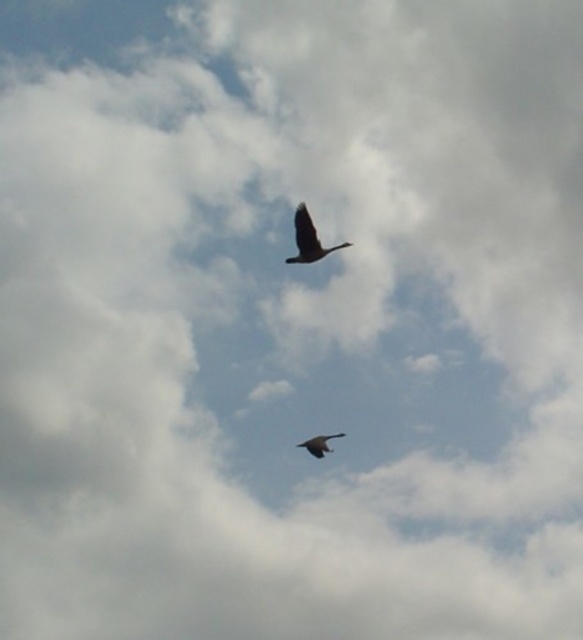
Question: Observing the image, what is the correct spatial positioning of dark brown feathered bird at upper center in reference to dark brown feathered bird at center?

Choices:
 (A) below
 (B) above

Answer: (B)

Question: Which of the following is the farthest from the observer?

Choices:
 (A) (317, 244)
 (B) (321, 445)

Answer: (B)

Question: Which point is closer to the camera?

Choices:
 (A) (324, 440)
 (B) (297, 216)

Answer: (B)

Question: Does dark brown feathered bird at upper center have a larger size compared to dark brown feathered bird at center?

Choices:
 (A) no
 (B) yes

Answer: (A)

Question: Does dark brown feathered bird at upper center appear over dark brown feathered bird at center?

Choices:
 (A) yes
 (B) no

Answer: (A)